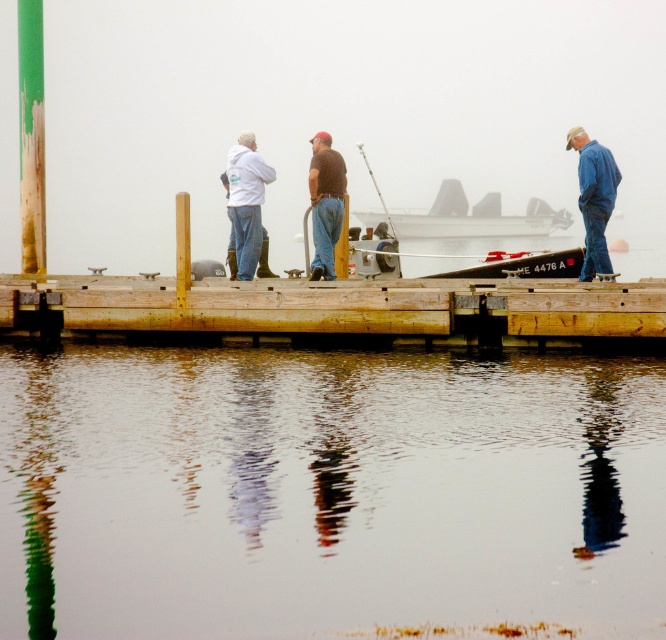
You are standing on the wooden dock and want to see your reflection in the water. Which object is closer to you, the smooth reflective water at center or the brown matte shirt at center?

The brown matte shirt at center is closer to you because it is positioned above the smooth reflective water at center.